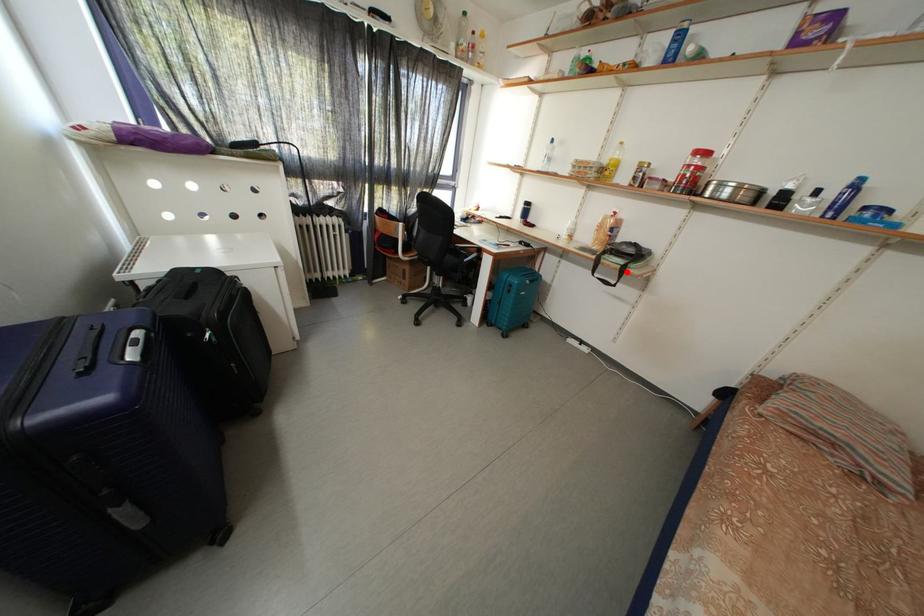
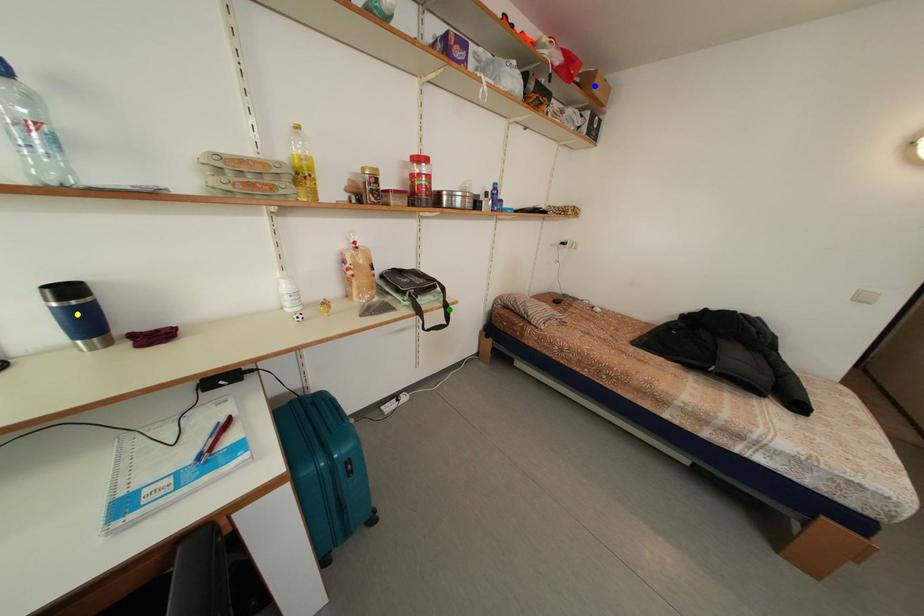
Question: I am providing you with two images of the same scene from different viewpoints. A red point is marked on the first image. You are given multiple points on the second image. Which point in image 2 represents the same 3d spot as the red point in image 1?

Choices:
 (A) blue point
 (B) yellow point
 (C) green point

Answer: (C)